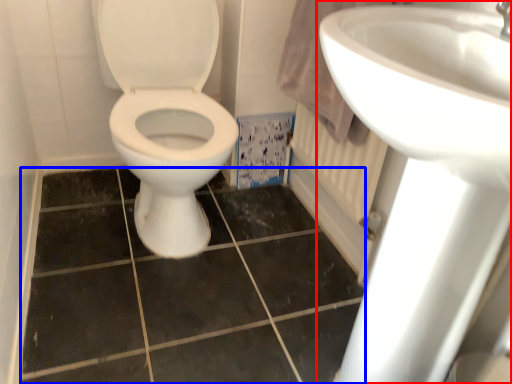
Question: Which object is closer to the camera taking this photo, sink (highlighted by a red box) or ceramic tile (highlighted by a blue box)?

Choices:
 (A) sink
 (B) ceramic tile

Answer: (A)